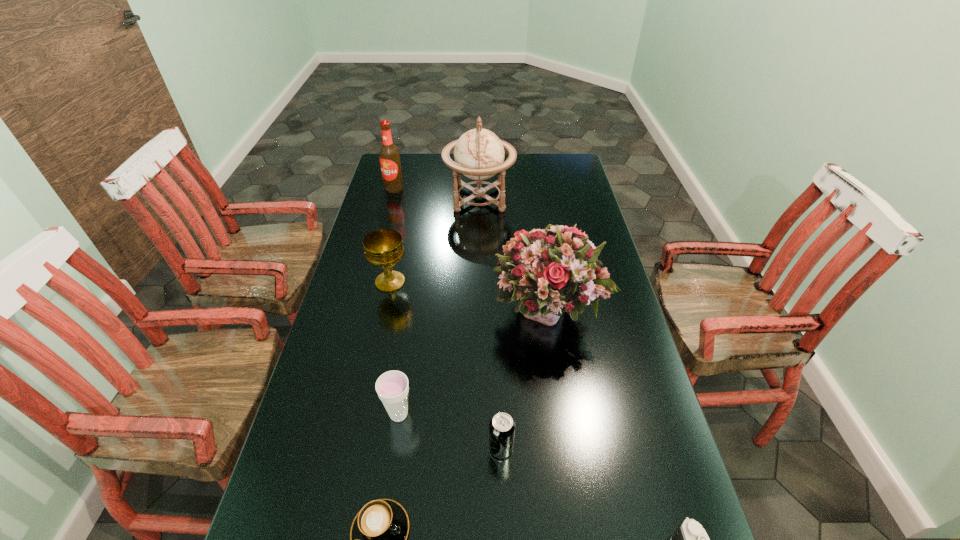
The image size is (960, 540). I want to click on globe, so click(x=479, y=154).

The width and height of the screenshot is (960, 540). Find the location of `bouquet`. bouquet is located at coordinates (548, 271).

Identify the location of beer bottle. This screenshot has height=540, width=960. (389, 155).

You are a GUI agent. You are given a task and a screenshot of the screen. Output one action in this format:
    pyautogui.click(x=<x>, y=<y>)
    Task: Click on the fifth shortest object
    The image size is (960, 540).
    Given the screenshot: What is the action you would take?
    pyautogui.click(x=383, y=248)

This screenshot has width=960, height=540. Find the location of `cup`. cup is located at coordinates point(392,387).

This screenshot has width=960, height=540. What are the coordinates of `soda can` in the screenshot? It's located at (502, 427).

The height and width of the screenshot is (540, 960). Identify the location of vacant space situated 0.240m at the front of the globe showing Africa. (573, 198).

Identify the location of vacant space located on the front of the bouquet. Image resolution: width=960 pixels, height=540 pixels. (570, 463).

The width and height of the screenshot is (960, 540). In order to click on free point located 0.110m on the back of the beer bottle in this screenshot , I will do `click(399, 170)`.

Identify the location of free space located on the back of the fourth tallest object. (401, 228).